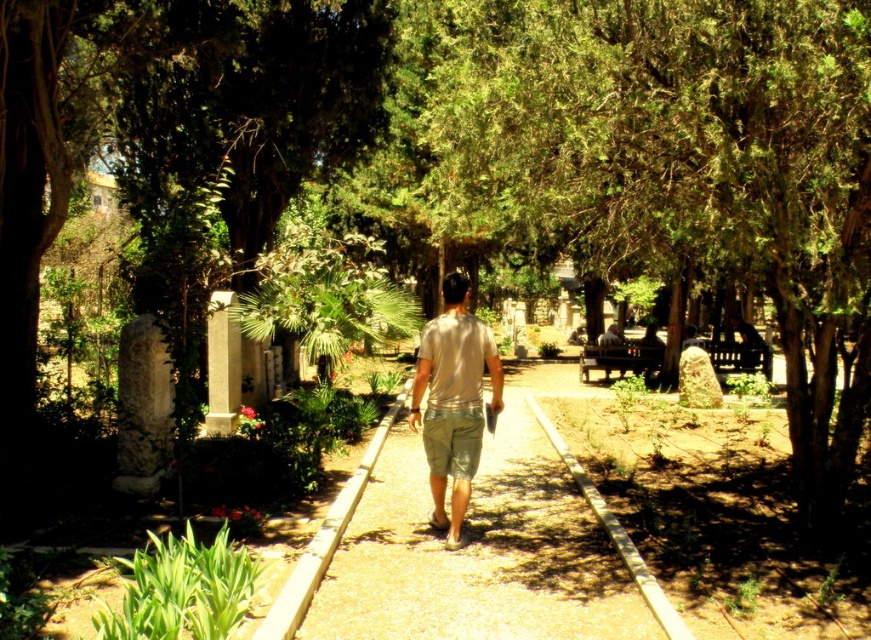
You are standing at the starting point of the smooth concrete path at center. If you walk straight ahead, will you eventually reach the man who is walking away from the camera?

The smooth concrete path at center is positioned at point (487,554), so yes, walking straight ahead along the smooth concrete path at center will lead you towards the man who is walking away from the camera since he is on the same path.

You are standing at the starting point of the smooth concrete path at center. If you walk towards the end of the path, how far will you have to walk?

The distance of smooth concrete path at center from viewer is 4.92 meters, so you will have to walk approximately 4.92 meters to reach the end of the path.

Looking at this image, you are standing at the entrance of the shaded pathway and see the smooth concrete path at center and the beige cotton shirt at center. Which object is closer to the ground?

The smooth concrete path at center is closer to the ground because it is located below the beige cotton shirt at center.